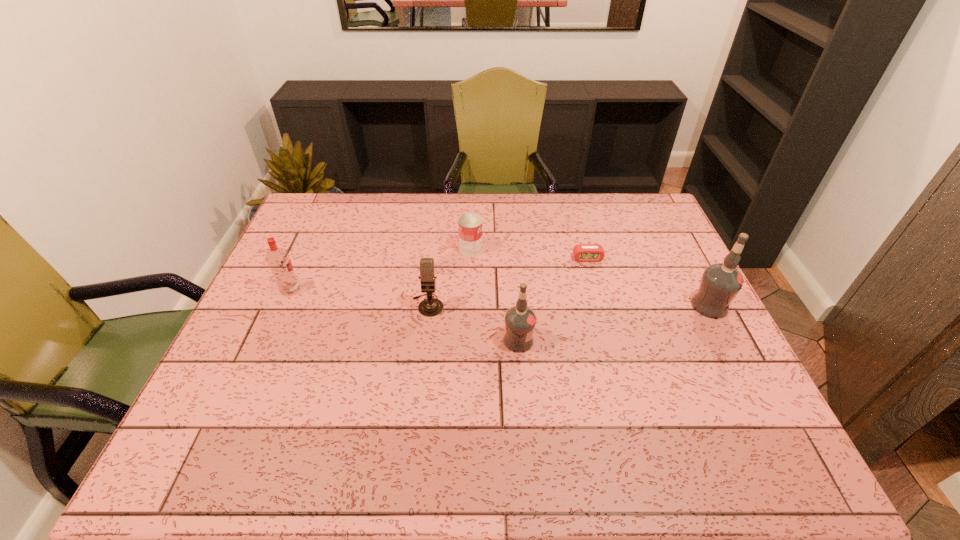
The width and height of the screenshot is (960, 540). I want to click on free space that satisfies the following two spatial constraints: 1. on the front-facing side of the shortest object; 2. on the front label of the fourth object from left to right, so click(x=610, y=340).

Image resolution: width=960 pixels, height=540 pixels. I want to click on vacant space that satisfies the following two spatial constraints: 1. on the front-facing side of the second object from right to left; 2. on the front label of the leftmost object, so click(596, 290).

Find the location of a particular element. vacant space that satisfies the following two spatial constraints: 1. on the front label of the fifth tallest object; 2. on the front-facing side of the microphone is located at coordinates (469, 305).

The height and width of the screenshot is (540, 960). In order to click on vacant space that satisfies the following two spatial constraints: 1. on the front label of the can; 2. on the front-facing side of the second object from left to right in this screenshot , I will do `click(469, 305)`.